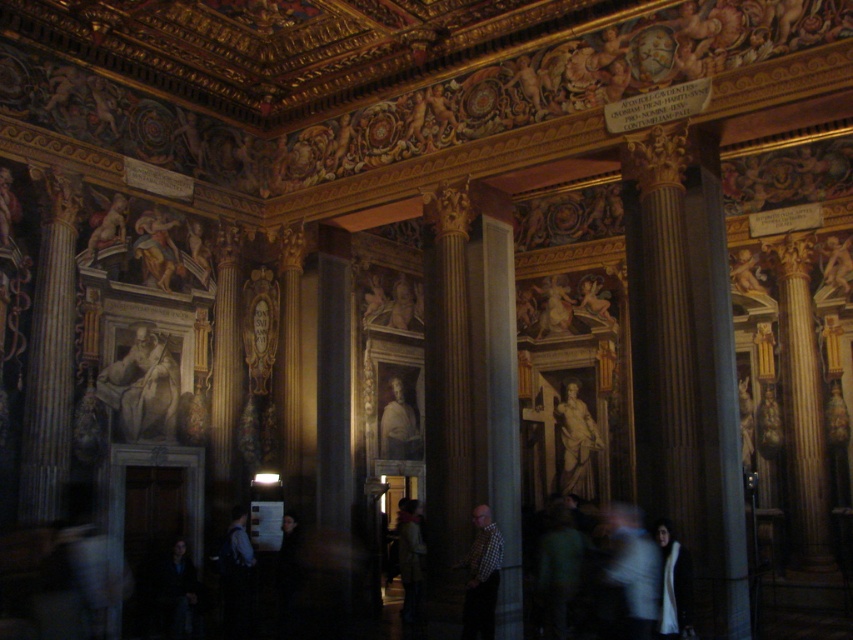
You are standing in the grand hall and want to move from the point at coordinate [669,561] to the point at coordinate [410,444]. Is the destination point closer to the ceiling or the floor?

The point at coordinate [410,444] is closer to the floor than the ceiling because it has a lower y coordinate than the point at [669,561], which is higher up.

You are an interior designer planning to place a large sculpture in this hall. The sculpture requires a space that can accommodate an object larger than the brown polished wood column at center. Is there enough space near the smooth gray portrait at center to place it?

The brown polished wood column at center is bigger than the smooth gray portrait at center. Therefore, the space near the smooth gray portrait at center may not be sufficient to accommodate an object larger than the brown polished wood column at center unless there is additional space available.

You are an interior designer planning to install a new chandelier in the grand hall. The chandelier will be placed exactly at the point marked as point (x=634, y=568). What object in the hall is located at this position?

The point (x=634, y=568) corresponds to the white cotton shirt at center, so the chandelier will be placed at the white cotton shirt at center.